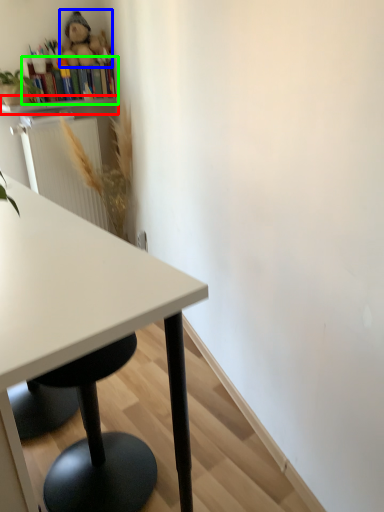
Question: Considering the real-world distances, which object is closest to shelf (highlighted by a red box)? toy (highlighted by a blue box) or bookshelf (highlighted by a green box).

Choices:
 (A) toy
 (B) bookshelf

Answer: (B)